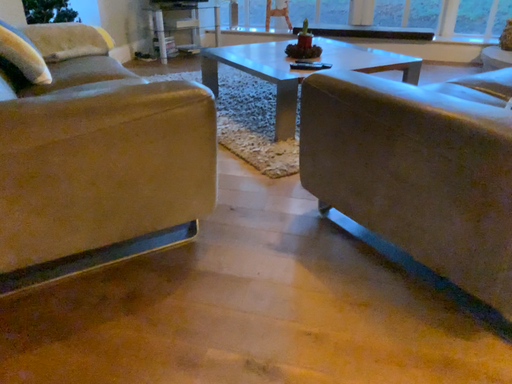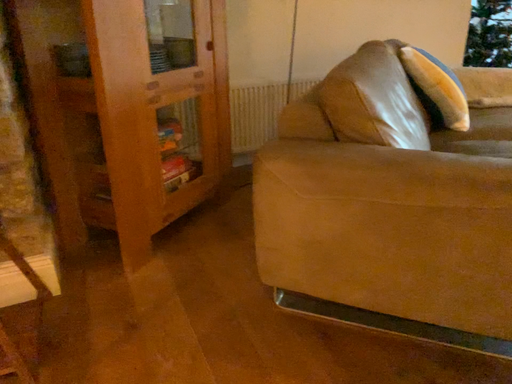
Question: Which way did the camera rotate in the video?

Choices:
 (A) rotated right
 (B) rotated left

Answer: (B)